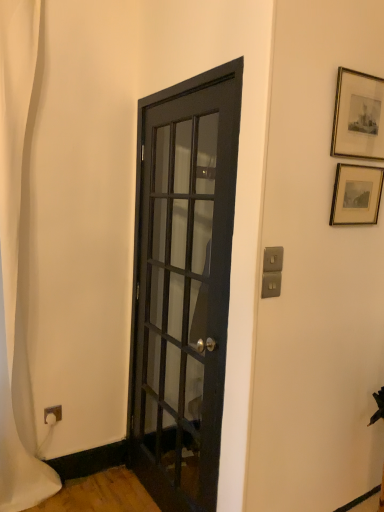
Question: Is gold-framed print at upper right, which is the first picture frame from top to bottom, wider than white fabric shower curtain at left?

Choices:
 (A) yes
 (B) no

Answer: (B)

Question: From the image's perspective, is gold-framed print at upper right, which is the first picture frame from top to bottom, above white fabric shower curtain at left?

Choices:
 (A) no
 (B) yes

Answer: (B)

Question: Does gold-framed print at upper right, the second picture frame in the bottom-to-top sequence, have a lesser width compared to white fabric shower curtain at left?

Choices:
 (A) yes
 (B) no

Answer: (A)

Question: Is gold-framed print at upper right, which is the first picture frame from top to bottom, looking in the opposite direction of white fabric shower curtain at left?

Choices:
 (A) yes
 (B) no

Answer: (B)

Question: From the image's perspective, is gold-framed print at upper right, which is the first picture frame from top to bottom, below white fabric shower curtain at left?

Choices:
 (A) yes
 (B) no

Answer: (B)

Question: Is gold-framed print at upper right, which is the first picture frame from top to bottom, to the left or to the right of matte black door at center in the image?

Choices:
 (A) left
 (B) right

Answer: (B)

Question: Considering the positions of gold-framed print at upper right, the second picture frame in the bottom-to-top sequence, and matte black door at center in the image, is gold-framed print at upper right, the second picture frame in the bottom-to-top sequence, taller or shorter than matte black door at center?

Choices:
 (A) tall
 (B) short

Answer: (B)

Question: Is gold-framed print at upper right, the second picture frame in the bottom-to-top sequence, inside the boundaries of matte black door at center, or outside?

Choices:
 (A) outside
 (B) inside

Answer: (A)

Question: Looking at the image, does gold-framed print at upper right, which is the first picture frame from top to bottom, seem bigger or smaller compared to matte black door at center?

Choices:
 (A) small
 (B) big

Answer: (A)

Question: In the image, is matte black door at center on the left side or the right side of gold-framed picture at upper right, which is the first picture frame from bottom to top?

Choices:
 (A) right
 (B) left

Answer: (B)

Question: From a real-world perspective, is matte black door at center above or below gold-framed picture at upper right, which is the first picture frame from bottom to top?

Choices:
 (A) below
 (B) above

Answer: (A)

Question: From the image's perspective, is matte black door at center positioned above or below gold-framed picture at upper right, which appears as the second picture frame when viewed from the top?

Choices:
 (A) above
 (B) below

Answer: (B)

Question: In terms of height, does matte black door at center look taller or shorter compared to gold-framed picture at upper right, which appears as the second picture frame when viewed from the top?

Choices:
 (A) tall
 (B) short

Answer: (A)

Question: In terms of width, does gold-framed picture at upper right, which is the first picture frame from bottom to top, look wider or thinner when compared to gold-framed print at upper right, the second picture frame in the bottom-to-top sequence?

Choices:
 (A) thin
 (B) wide

Answer: (B)

Question: Is gold-framed picture at upper right, which is the first picture frame from bottom to top, bigger or smaller than gold-framed print at upper right, which is the first picture frame from top to bottom?

Choices:
 (A) big
 (B) small

Answer: (B)